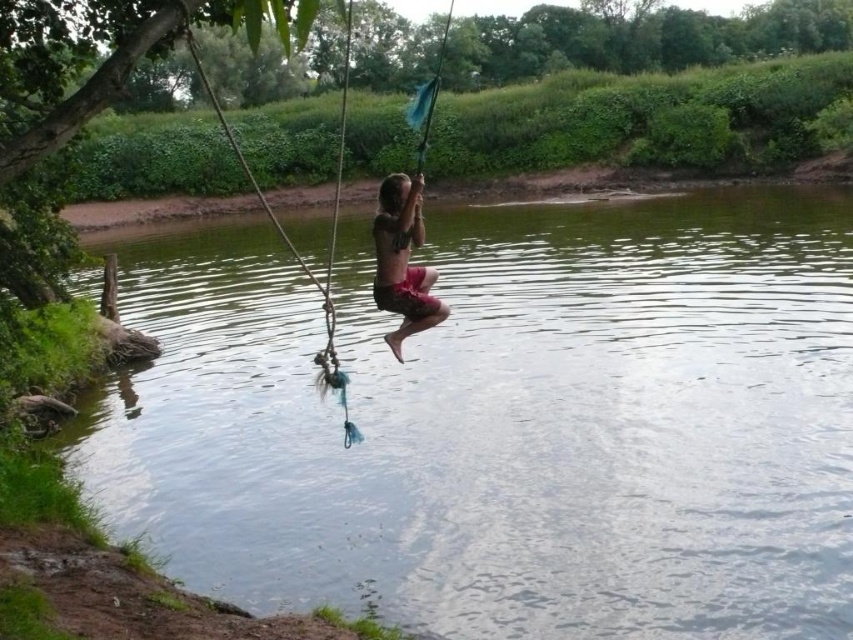
Question: Is the position of rope swing at center less distant than that of matte red shorts at center?

Choices:
 (A) no
 (B) yes

Answer: (B)

Question: Can you confirm if clear water at center is positioned to the right of rope swing at center?

Choices:
 (A) yes
 (B) no

Answer: (A)

Question: Can you confirm if clear water at center is positioned to the left of matte red shorts at center?

Choices:
 (A) yes
 (B) no

Answer: (A)

Question: Which of the following is the farthest from the observer?

Choices:
 (A) matte red shorts at center
 (B) rope swing at center

Answer: (A)

Question: Which point is closer to the camera?

Choices:
 (A) clear water at center
 (B) rope swing at center

Answer: (B)

Question: Which point is farther to the camera?

Choices:
 (A) (392, 188)
 (B) (706, 404)
 (C) (347, 35)

Answer: (C)